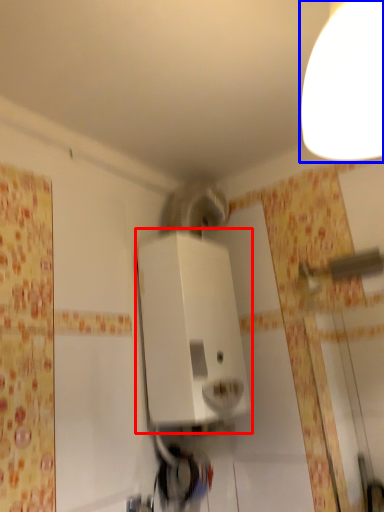
Question: Which object appears farthest to the camera in this image, appliance (highlighted by a red box) or light fixture (highlighted by a blue box)?

Choices:
 (A) appliance
 (B) light fixture

Answer: (A)